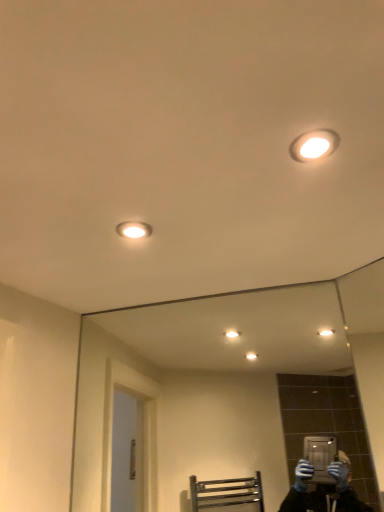
The image size is (384, 512). I want to click on matte white light fixture at upper left, which ranks as the first light fixture in left-to-right order, so click(x=134, y=230).

What do you see at coordinates (134, 230) in the screenshot? The height and width of the screenshot is (512, 384). I see `matte white light fixture at upper left, which ranks as the first light fixture in left-to-right order` at bounding box center [134, 230].

Where is `clear glass mirror at center`? The width and height of the screenshot is (384, 512). clear glass mirror at center is located at coordinates (232, 391).

What do you see at coordinates (314, 145) in the screenshot? The width and height of the screenshot is (384, 512). I see `matte white light fixture at upper right, which ranks as the first light fixture in front-to-back order` at bounding box center [314, 145].

Locate an element on the screen. matte white light fixture at upper left, which ranks as the first light fixture in left-to-right order is located at coordinates (134, 230).

How different are the orientations of matte white light fixture at upper left, acting as the first light fixture starting from the bottom, and matte white light fixture at upper right, which is the second light fixture from bottom to top, in degrees?

matte white light fixture at upper left, acting as the first light fixture starting from the bottom, and matte white light fixture at upper right, which is the second light fixture from bottom to top, are facing 93.3 degrees away from each other.

Does matte white light fixture at upper left, which ranks as the 2th light fixture in right-to-left order, touch matte white light fixture at upper right, which is the 2th light fixture in left-to-right order?

No, matte white light fixture at upper left, which ranks as the 2th light fixture in right-to-left order, is not making contact with matte white light fixture at upper right, which is the 2th light fixture in left-to-right order.

In terms of size, does matte white light fixture at upper left, the first light fixture viewed from the back, appear bigger or smaller than matte white light fixture at upper right, which is the 2th light fixture in left-to-right order?

In the image, matte white light fixture at upper left, the first light fixture viewed from the back, appears to be larger than matte white light fixture at upper right, which is the 2th light fixture in left-to-right order.

Is matte white light fixture at upper left, the 2th light fixture in the front-to-back sequence, looking in the opposite direction of matte white light fixture at upper right, which is the second light fixture from bottom to top?

No, matte white light fixture at upper right, which is the second light fixture from bottom to top, is not at the back of matte white light fixture at upper left, the 2th light fixture in the front-to-back sequence.

Would you say matte white light fixture at upper left, which ranks as the 2th light fixture in right-to-left order, is part of clear glass mirror at center's contents?

No, matte white light fixture at upper left, which ranks as the 2th light fixture in right-to-left order, is not inside clear glass mirror at center.

How distant is clear glass mirror at center from matte white light fixture at upper left, which ranks as the 2th light fixture in right-to-left order?

clear glass mirror at center and matte white light fixture at upper left, which ranks as the 2th light fixture in right-to-left order, are 5.26 feet apart from each other.

Are clear glass mirror at center and matte white light fixture at upper left, which ranks as the 2th light fixture in right-to-left order, far apart?

Indeed, clear glass mirror at center is not near matte white light fixture at upper left, which ranks as the 2th light fixture in right-to-left order.

Is clear glass mirror at center bigger than matte white light fixture at upper left, which ranks as the 2th light fixture in right-to-left order?

Correct, clear glass mirror at center is larger in size than matte white light fixture at upper left, which ranks as the 2th light fixture in right-to-left order.

Can you tell me how much matte white light fixture at upper left, acting as the first light fixture starting from the bottom, and clear glass mirror at center differ in facing direction?

There is a 41.4-degree angle between the facing directions of matte white light fixture at upper left, acting as the first light fixture starting from the bottom, and clear glass mirror at center.

Can you see matte white light fixture at upper left, acting as the first light fixture starting from the bottom, touching clear glass mirror at center?

matte white light fixture at upper left, acting as the first light fixture starting from the bottom, is not next to clear glass mirror at center, and they're not touching.

Is matte white light fixture at upper left, which ranks as the first light fixture in left-to-right order, facing towards clear glass mirror at center?

No, matte white light fixture at upper left, which ranks as the first light fixture in left-to-right order, is not oriented towards clear glass mirror at center.

Is matte white light fixture at upper left, the 2th light fixture in the front-to-back sequence, thinner than clear glass mirror at center?

No.

Is matte white light fixture at upper right, which is counted as the 1th light fixture, starting from the right, located outside matte white light fixture at upper left, acting as the first light fixture starting from the bottom?

Yes, matte white light fixture at upper right, which is counted as the 1th light fixture, starting from the right, is not within matte white light fixture at upper left, acting as the first light fixture starting from the bottom.

Can you confirm if matte white light fixture at upper right, which ranks as the first light fixture in front-to-back order, is thinner than matte white light fixture at upper left, which ranks as the 2th light fixture in right-to-left order?

No, matte white light fixture at upper right, which ranks as the first light fixture in front-to-back order, is not thinner than matte white light fixture at upper left, which ranks as the 2th light fixture in right-to-left order.

In the scene shown: Does matte white light fixture at upper right, which is counted as the 1th light fixture, starting from the right, have a smaller size compared to matte white light fixture at upper left, the 2th light fixture in the front-to-back sequence?

Correct, matte white light fixture at upper right, which is counted as the 1th light fixture, starting from the right, occupies less space than matte white light fixture at upper left, the 2th light fixture in the front-to-back sequence.

Find the location of a particular element. light fixture on the right of clear glass mirror at center is located at coordinates (314, 145).

Which object is more forward, clear glass mirror at center or matte white light fixture at upper right, the 2th light fixture from the back?

matte white light fixture at upper right, the 2th light fixture from the back, is in front.

From their relative heights in the image, would you say clear glass mirror at center is taller or shorter than matte white light fixture at upper right, positioned as the first light fixture in top-to-bottom order?

In the image, clear glass mirror at center appears to be taller than matte white light fixture at upper right, positioned as the first light fixture in top-to-bottom order.

Could matte white light fixture at upper right, the 2th light fixture from the back, be considered to be inside clear glass mirror at center?

No, matte white light fixture at upper right, the 2th light fixture from the back, is not inside clear glass mirror at center.

Is matte white light fixture at upper right, which is the 2th light fixture in left-to-right order, oriented towards clear glass mirror at center?

No, matte white light fixture at upper right, which is the 2th light fixture in left-to-right order, does not turn towards clear glass mirror at center.

Does matte white light fixture at upper right, which ranks as the first light fixture in front-to-back order, lie in front of clear glass mirror at center?

Yes, it is.

From the image's perspective, is matte white light fixture at upper right, which ranks as the first light fixture in front-to-back order, on top of clear glass mirror at center?

Yes, from the image's perspective, matte white light fixture at upper right, which ranks as the first light fixture in front-to-back order, is over clear glass mirror at center.

Who is bigger, matte white light fixture at upper right, the 2th light fixture from the back, or clear glass mirror at center?

With larger size is clear glass mirror at center.

There is a matte white light fixture at upper left, positioned as the second light fixture in top-to-bottom order. Where is `light fixture above it (from a real-world perspective)`? light fixture above it (from a real-world perspective) is located at coordinates (314, 145).

Where is `mirror that is under the matte white light fixture at upper left, acting as the first light fixture starting from the bottom (from a real-world perspective)`? mirror that is under the matte white light fixture at upper left, acting as the first light fixture starting from the bottom (from a real-world perspective) is located at coordinates (232, 391).

When comparing their distances from clear glass mirror at center, does matte white light fixture at upper right, which ranks as the first light fixture in front-to-back order, or matte white light fixture at upper left, the first light fixture viewed from the back, seem closer?

matte white light fixture at upper left, the first light fixture viewed from the back, is positioned closer to the anchor clear glass mirror at center.

When comparing their distances from matte white light fixture at upper right, which is the 2th light fixture in left-to-right order, does clear glass mirror at center or matte white light fixture at upper left, positioned as the second light fixture in top-to-bottom order, seem closer?

matte white light fixture at upper left, positioned as the second light fixture in top-to-bottom order, lies closer to matte white light fixture at upper right, which is the 2th light fixture in left-to-right order, than the other object.

Which object lies nearer to the anchor point matte white light fixture at upper left, which ranks as the first light fixture in left-to-right order, clear glass mirror at center or matte white light fixture at upper right, the 2th light fixture from the back?

Based on the image, matte white light fixture at upper right, the 2th light fixture from the back, appears to be nearer to matte white light fixture at upper left, which ranks as the first light fixture in left-to-right order.

When comparing their distances from matte white light fixture at upper left, positioned as the second light fixture in top-to-bottom order, does matte white light fixture at upper right, positioned as the first light fixture in top-to-bottom order, or clear glass mirror at center seem further?

clear glass mirror at center.

Estimate the real-world distances between objects in this image. Which object is further from clear glass mirror at center, matte white light fixture at upper left, the 2th light fixture in the front-to-back sequence, or matte white light fixture at upper right, which is counted as the 1th light fixture, starting from the right?

matte white light fixture at upper right, which is counted as the 1th light fixture, starting from the right, is further to clear glass mirror at center.

Based on the photo, which object lies nearer to the anchor point matte white light fixture at upper right, positioned as the first light fixture in top-to-bottom order, matte white light fixture at upper left, positioned as the second light fixture in top-to-bottom order, or clear glass mirror at center?

Among the two, matte white light fixture at upper left, positioned as the second light fixture in top-to-bottom order, is located nearer to matte white light fixture at upper right, positioned as the first light fixture in top-to-bottom order.

Find the location of a particular element. light fixture between matte white light fixture at upper right, positioned as the first light fixture in top-to-bottom order, and clear glass mirror at center in the up-down direction is located at coordinates (134, 230).